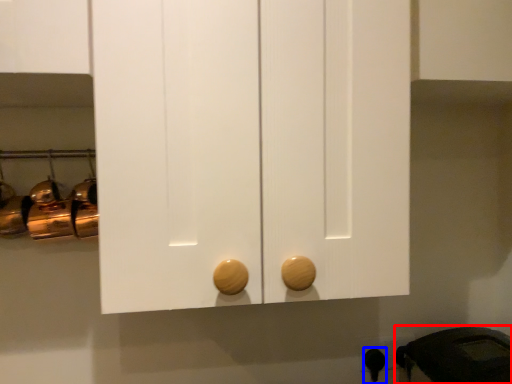
Question: Which object appears closest to the camera in this image, appliance (highlighted by a red box) or door handle (highlighted by a blue box)?

Choices:
 (A) appliance
 (B) door handle

Answer: (A)